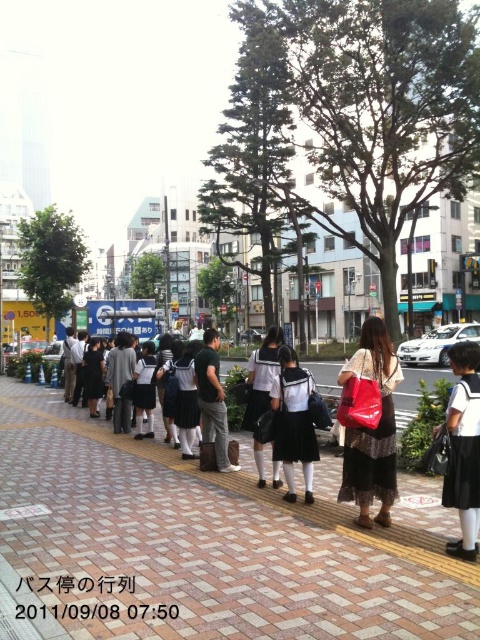
Question: Considering the relative positions of brick pavement at center and matte black dress at center in the image provided, where is brick pavement at center located with respect to matte black dress at center?

Choices:
 (A) right
 (B) left

Answer: (B)

Question: In this image, where is brick pavement at center located relative to dark gray fabric jacket at center?

Choices:
 (A) below
 (B) above

Answer: (A)

Question: Based on their relative distances, which object is nearer to the matte black dress at center?

Choices:
 (A) brick pavement at center
 (B) white uniform skirt at center
 (C) dark gray fabric jacket at center
 (D) white uniform at center

Answer: (D)

Question: Which point is closer to the camera taking this photo?

Choices:
 (A) (204, 435)
 (B) (334, 592)
 (C) (363, 508)

Answer: (B)

Question: Can you confirm if white uniform skirt at center is smaller than dark gray fabric jacket at center?

Choices:
 (A) no
 (B) yes

Answer: (A)

Question: Which object is positioned closest to the white uniform at center?

Choices:
 (A) white uniform skirt at center
 (B) dark gray fabric jacket at center
 (C) brick pavement at center

Answer: (C)